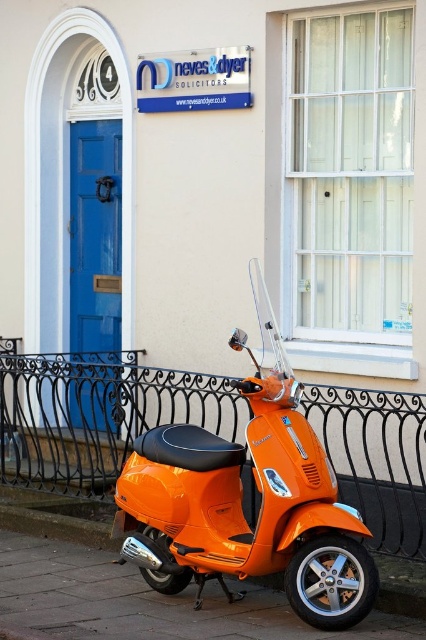
Question: Is orange matte scooter at lower center thinner than blue wooden door at left?

Choices:
 (A) no
 (B) yes

Answer: (A)

Question: Does orange glossy scooter at center have a larger size compared to orange matte scooter at lower center?

Choices:
 (A) yes
 (B) no

Answer: (A)

Question: Which point appears closest to the camera in this image?

Choices:
 (A) (310, 445)
 (B) (111, 209)
 (C) (339, 483)

Answer: (A)

Question: Can you confirm if black wrought iron fence at lower center is wider than orange matte scooter at lower center?

Choices:
 (A) yes
 (B) no

Answer: (B)

Question: Which point appears closest to the camera in this image?

Choices:
 (A) (250, 282)
 (B) (383, 544)

Answer: (B)

Question: Which object is closer to the camera taking this photo?

Choices:
 (A) orange glossy scooter at center
 (B) black wrought iron fence at lower center

Answer: (A)